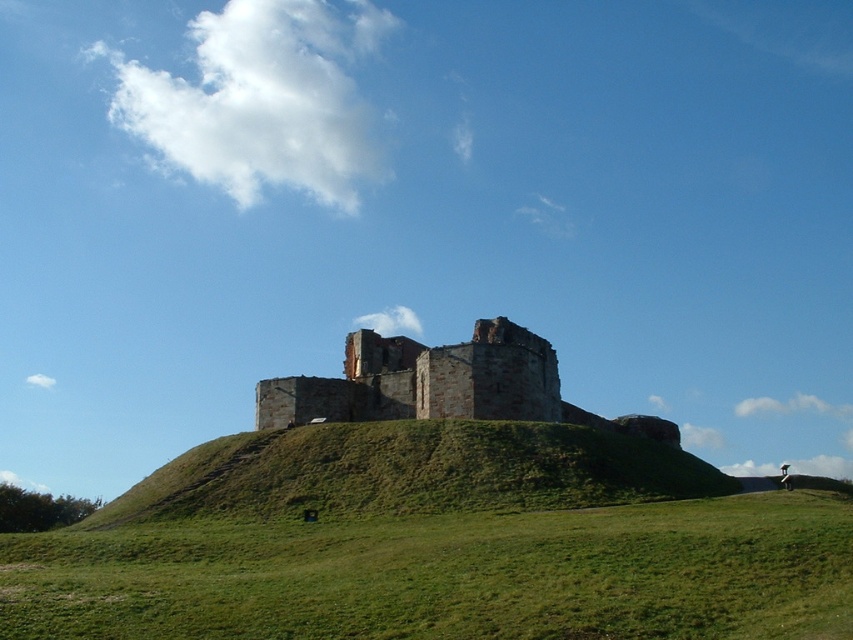
Question: Can you confirm if green grassy hill at lower center is thinner than green grassy hillside at center?

Choices:
 (A) yes
 (B) no

Answer: (B)

Question: Based on their relative distances, which object is nearer to the green grassy hillside at center?

Choices:
 (A) green grassy hill at lower center
 (B) brown stone castle at center

Answer: (A)

Question: Does green grassy hill at lower center appear over green grassy hillside at center?

Choices:
 (A) no
 (B) yes

Answer: (A)

Question: Is green grassy hillside at center wider than brown stone castle at center?

Choices:
 (A) yes
 (B) no

Answer: (A)

Question: Which point is closer to the camera?

Choices:
 (A) (138, 618)
 (B) (480, 326)
 (C) (628, 500)

Answer: (A)

Question: Which object is the closest to the brown stone castle at center?

Choices:
 (A) green grassy hillside at center
 (B) green grassy hill at lower center

Answer: (A)